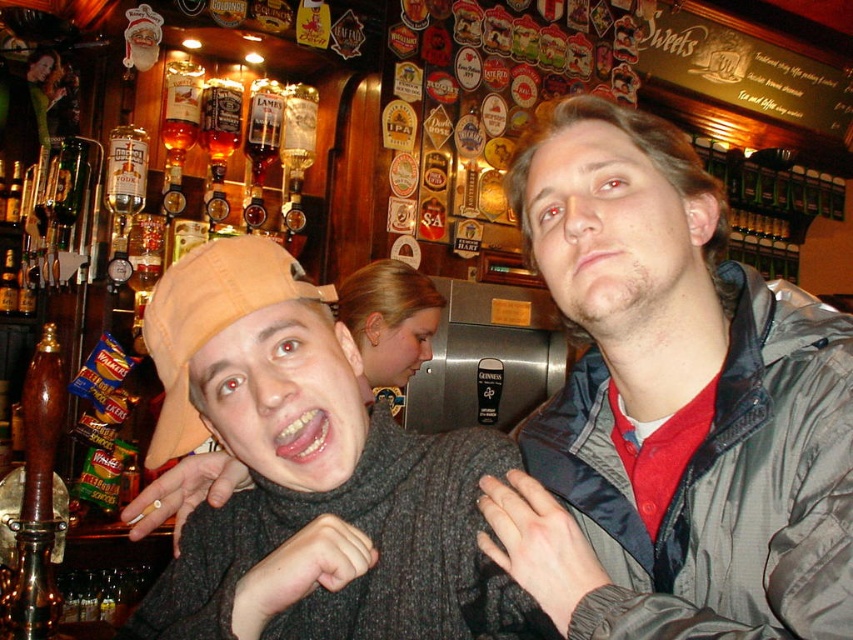
Does point (604, 369) lie behind point (358, 506)?

Yes, point (604, 369) is behind point (358, 506).

Who is more forward, (680, 548) or (218, 284)?

Point (680, 548) is more forward.

Which is in front, point (804, 557) or point (202, 324)?

Point (804, 557) is in front.

Locate an element on the screen. This screenshot has width=853, height=640. gray fabric jacket at center is located at coordinates (672, 408).